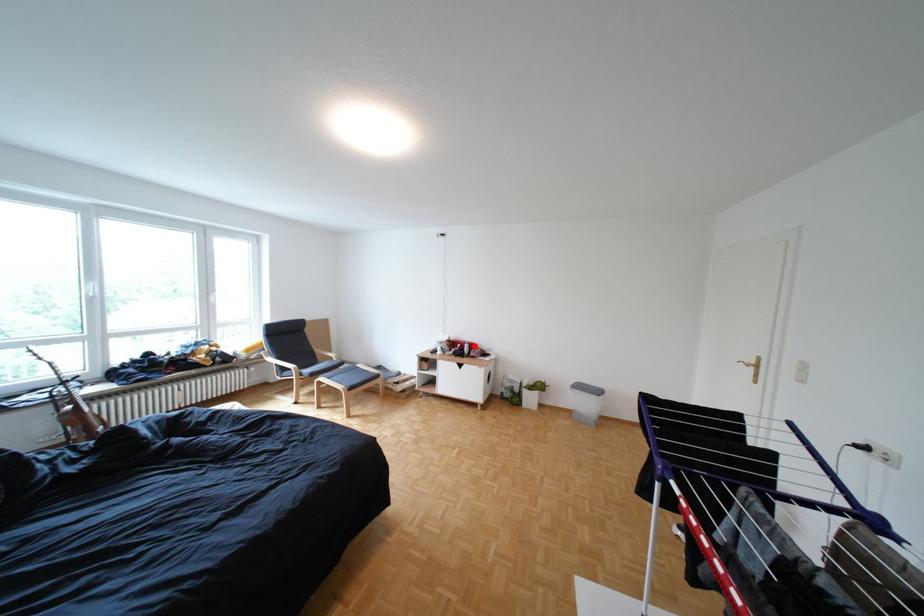
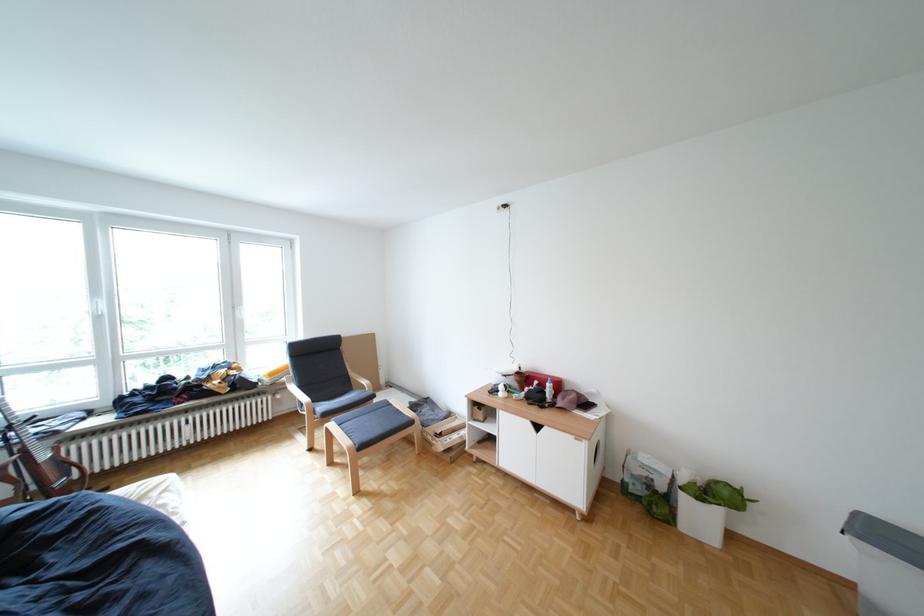
Where in the second image is the point corresponding to the highlighted location from the first image?

(552, 383)